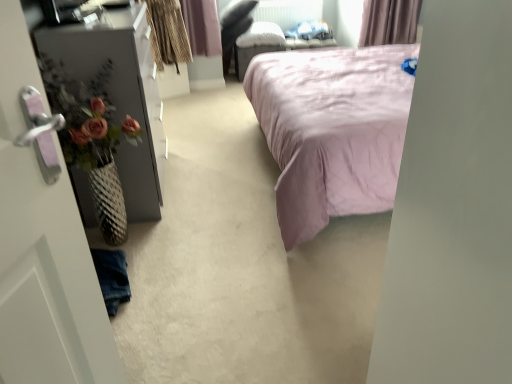
The height and width of the screenshot is (384, 512). Identify the location of blank space above white plastic radiator at upper center (from a real-world perspective). (284, 2).